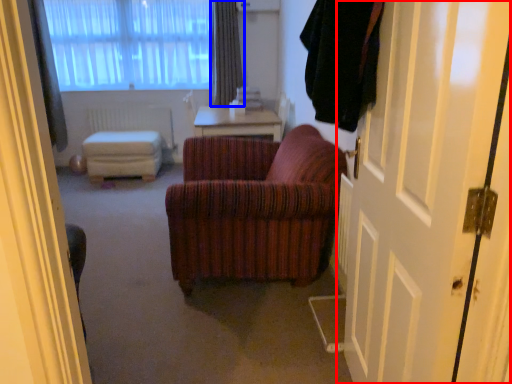
Question: Which of the following is the farthest to the observer, door (highlighted by a red box) or curtain (highlighted by a blue box)?

Choices:
 (A) door
 (B) curtain

Answer: (B)